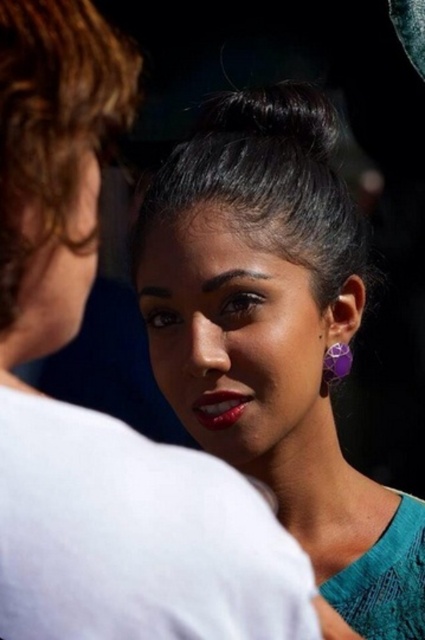
From the picture: You are a photographer trying to capture a close portrait of the woman. You notice the curly brown hair at left and the shiny red lipstick at lower center. Which object is closer to the camera based on their positions?

The curly brown hair at left is closer to the camera because it is in front of the shiny red lipstick at lower center.

You are an artist trying to sketch the scene. You need to place the black shiny hair at center in your drawing. Where should you position it on a coordinate system from 0 to 1 in both x and y axes?

The black shiny hair at center should be positioned at coordinates approximately 0.286 on the x axis and 0.626 on the y axis.

You are a photographer trying to capture the subject with a shallow depth of field. The focus point is set at point (53,124). Based on the scene description, what part of the woman is likely in focus?

The point (53,124) corresponds to the curly brown hair at left, so the curly brown hair at left is in focus.